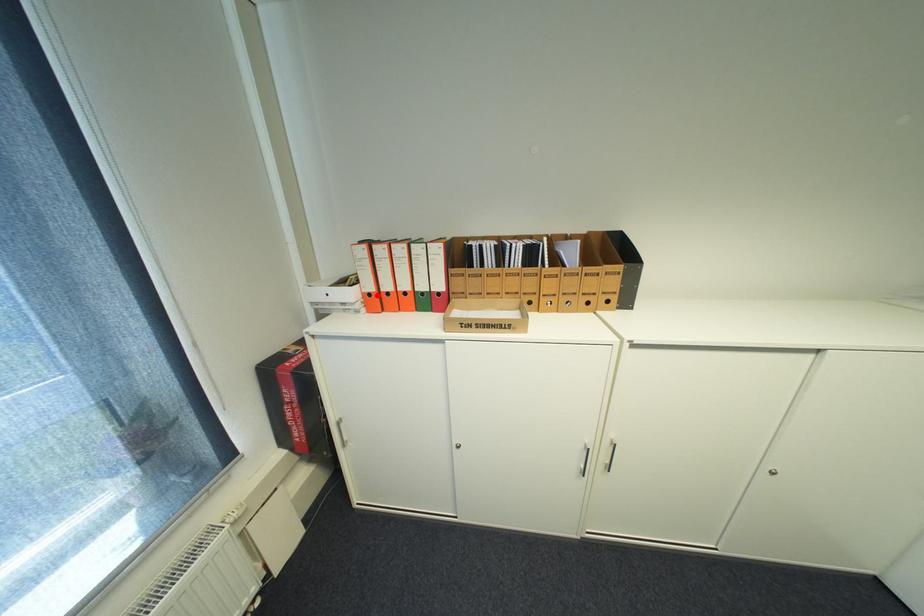
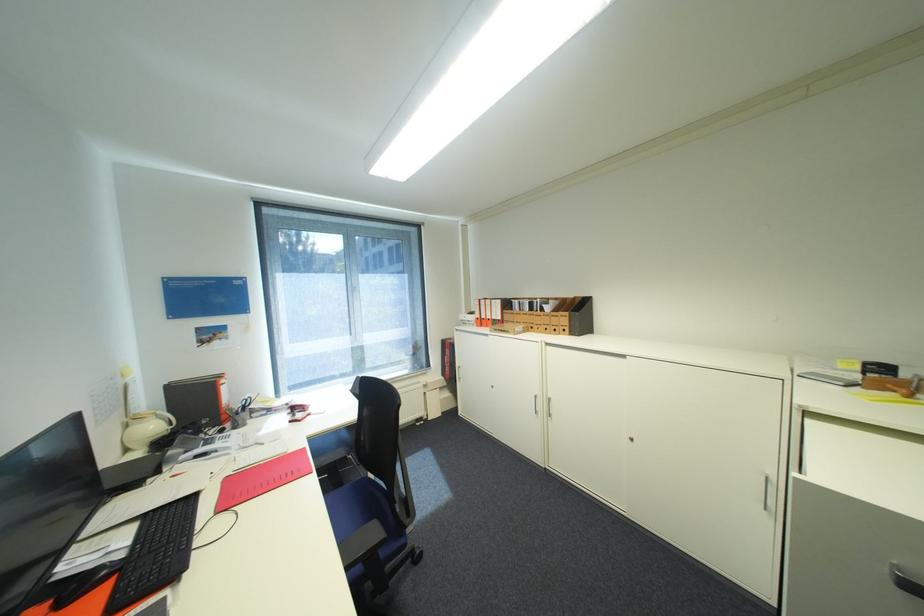
Where in the second image is the point corresponding to the highlighted location from the first image?

(485, 318)